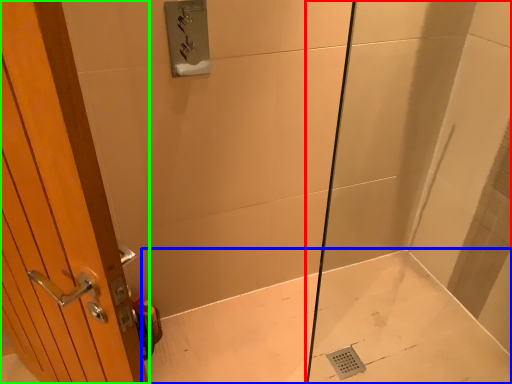
Question: Which object is positioned farthest from shower door (highlighted by a red box)? Select from bath (highlighted by a blue box) and door (highlighted by a green box).

Choices:
 (A) bath
 (B) door

Answer: (B)